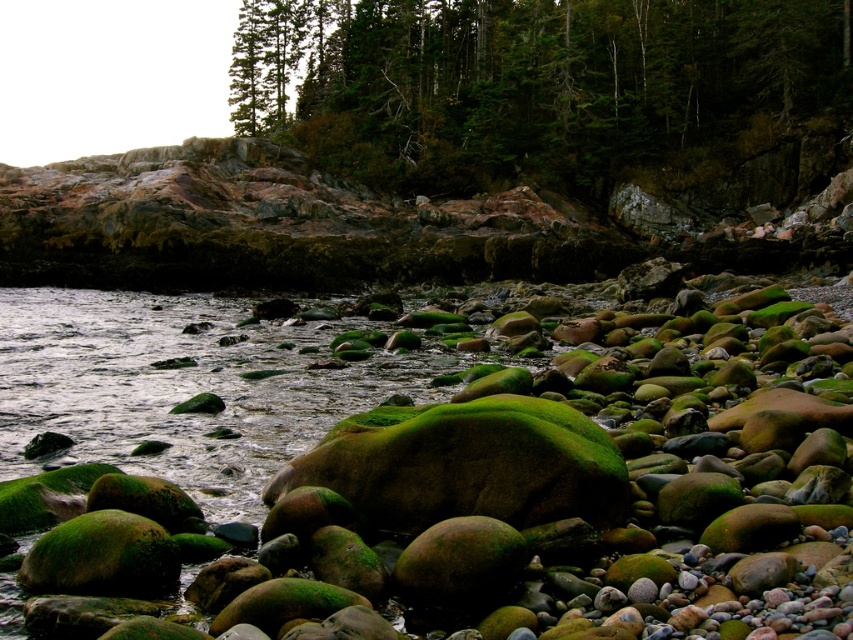
Who is positioned more to the right, green textured tree at upper center or green mossy rock at center?

green textured tree at upper center is more to the right.

Can you confirm if green textured tree at upper center is bigger than green mossy rock at center?

Yes, green textured tree at upper center is bigger than green mossy rock at center.

Identify the location of green textured tree at upper center. The width and height of the screenshot is (853, 640). (544, 86).